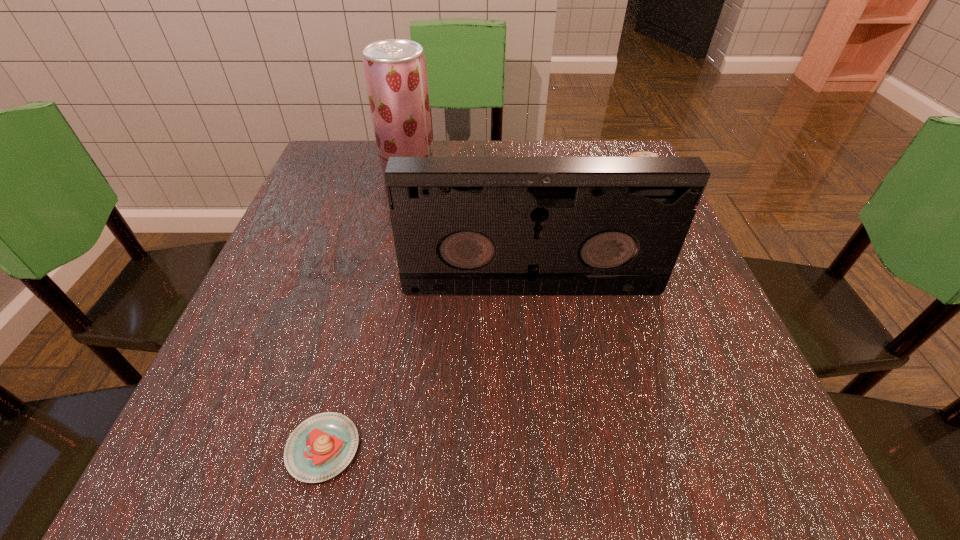
The image size is (960, 540). I want to click on free spot at the near edge of the desktop, so click(455, 477).

Where is `vacant space at the left edge of the desktop`? Image resolution: width=960 pixels, height=540 pixels. vacant space at the left edge of the desktop is located at coordinates (322, 358).

The width and height of the screenshot is (960, 540). What are the coordinates of `vacant space at the right edge of the desktop` in the screenshot? It's located at (735, 397).

The image size is (960, 540). In the image, there is a desktop. What are the coordinates of `vacant space at the far left corner` in the screenshot? It's located at (332, 152).

At what (x,y) coordinates should I click in order to perform the action: click on free region at the near left corner of the desktop. Please return your answer as a coordinate pair (x, y). Looking at the image, I should click on (266, 489).

Image resolution: width=960 pixels, height=540 pixels. I want to click on free space between the nearer pastry and the taller pastry, so click(x=478, y=321).

The width and height of the screenshot is (960, 540). In order to click on free space between the third farthest object and the shortest object in this screenshot , I will do `click(427, 367)`.

Locate an element on the screen. This screenshot has height=540, width=960. the second closest object to the right pastry is located at coordinates (395, 70).

Locate an element on the screen. This screenshot has height=540, width=960. the second closest object to the nearest object is located at coordinates (395, 70).